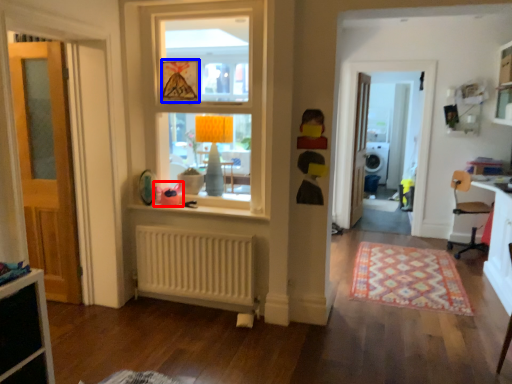
Question: Among these objects, which one is farthest to the camera, toy (highlighted by a red box) or picture frame (highlighted by a blue box)?

Choices:
 (A) toy
 (B) picture frame

Answer: (A)